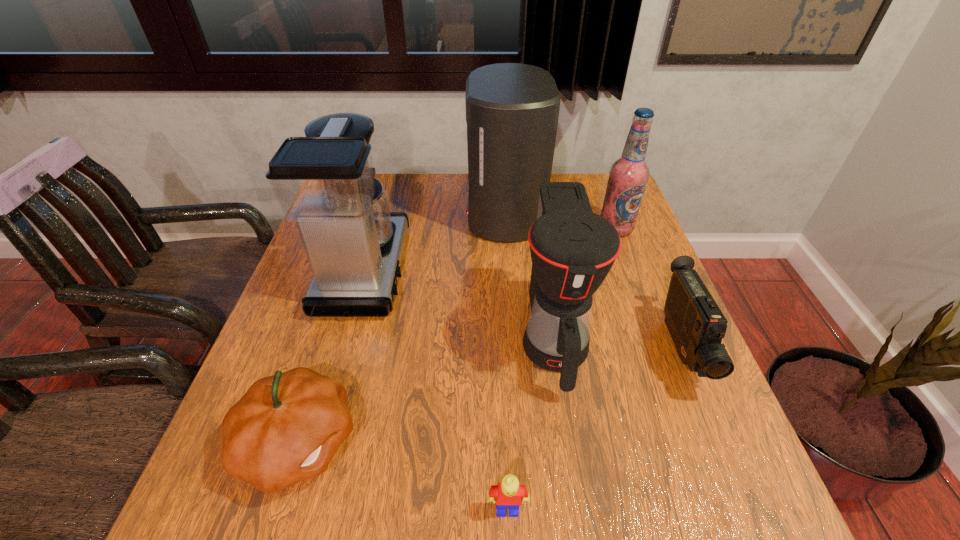
At what (x,y) coordinates should I click in order to perform the action: click on object identified as the fifth closest to the leftmost coffee maker. Please return your answer as a coordinate pair (x, y). Looking at the image, I should click on (628, 176).

Select which object appears as the closest to the camcorder. Please provide its 2D coordinates. Your answer should be formatted as a tuple, i.e. [(x, y)], where the tuple contains the x and y coordinates of a point satisfying the conditions above.

[(572, 249)]

Point out which coffee maker is positioned as the third nearest to the Lego. Please provide its 2D coordinates. Your answer should be formatted as a tuple, i.e. [(x, y)], where the tuple contains the x and y coordinates of a point satisfying the conditions above.

[(512, 109)]

Locate an element on the screen. The width and height of the screenshot is (960, 540). coffee maker that can be found as the closest to the alcohol is located at coordinates (512, 109).